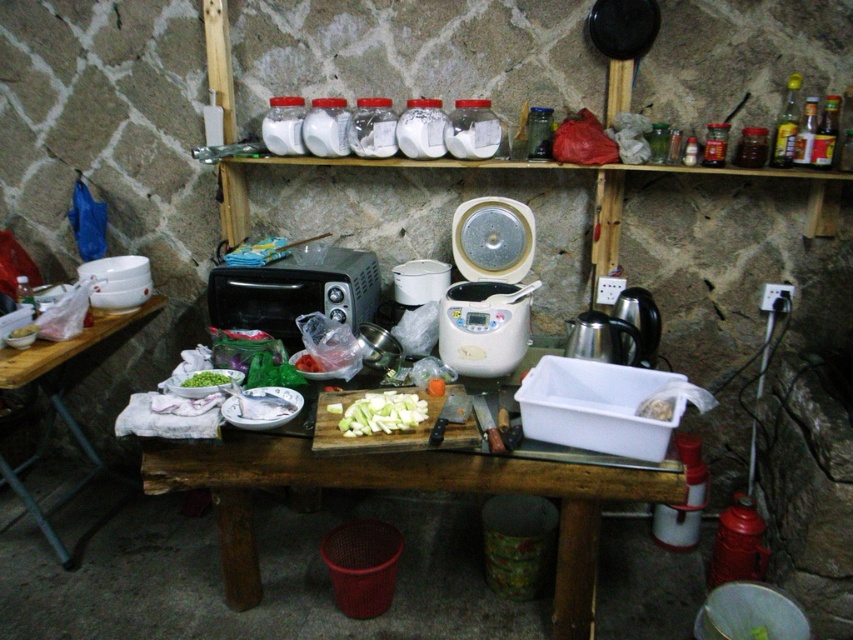
Question: Among these points, which one is farthest from the camera?

Choices:
 (A) (282, 465)
 (B) (149, 308)
 (C) (354, 435)
 (D) (341, 310)

Answer: (B)

Question: Is wooden cutting board at center wider than green matte bowl at lower left?

Choices:
 (A) no
 (B) yes

Answer: (B)

Question: Does matte black toaster oven at center have a smaller size compared to green matte bowl at lower left?

Choices:
 (A) yes
 (B) no

Answer: (B)

Question: Estimate the real-world distances between objects in this image. Which object is closer to the white plastic rice cooker at center?

Choices:
 (A) green matte sliced vegetables at center
 (B) matte black toaster oven at center

Answer: (A)

Question: Among these points, which one is farthest from the camera?

Choices:
 (A) (556, 628)
 (B) (370, 275)

Answer: (B)

Question: Does wooden cutting board at center have a smaller size compared to green matte bowl at center?

Choices:
 (A) yes
 (B) no

Answer: (B)